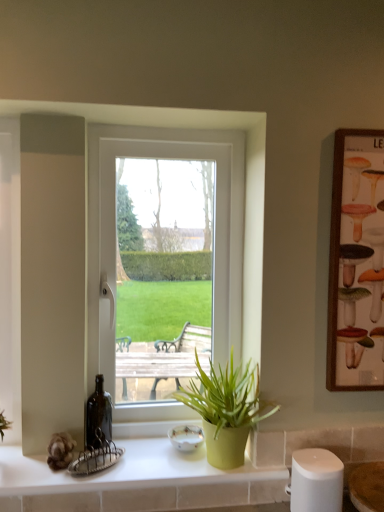
Question: Are green matte pot at lower center and white plastic window at center making contact?

Choices:
 (A) yes
 (B) no

Answer: (B)

Question: From a real-world perspective, is green matte pot at lower center located higher than white plastic window at center?

Choices:
 (A) yes
 (B) no

Answer: (B)

Question: Can you confirm if green matte pot at lower center is bigger than white plastic window at center?

Choices:
 (A) yes
 (B) no

Answer: (B)

Question: Can we say green matte pot at lower center lies outside white plastic window at center?

Choices:
 (A) yes
 (B) no

Answer: (A)

Question: Considering the relative sizes of green matte pot at lower center and white plastic window at center in the image provided, is green matte pot at lower center smaller than white plastic window at center?

Choices:
 (A) yes
 (B) no

Answer: (A)

Question: From the image's perspective, is green matte pot at lower center over white plastic window at center?

Choices:
 (A) yes
 (B) no

Answer: (B)

Question: Would you say wooden framed poster at right is part of green matte pot at lower center's contents?

Choices:
 (A) no
 (B) yes

Answer: (A)

Question: Is the depth of green matte pot at lower center greater than that of wooden framed poster at right?

Choices:
 (A) no
 (B) yes

Answer: (A)

Question: Does green matte pot at lower center come in front of wooden framed poster at right?

Choices:
 (A) no
 (B) yes

Answer: (B)

Question: Does green matte pot at lower center have a smaller size compared to wooden framed poster at right?

Choices:
 (A) no
 (B) yes

Answer: (A)

Question: Is green matte pot at lower center to the right of wooden framed poster at right from the viewer's perspective?

Choices:
 (A) yes
 (B) no

Answer: (B)

Question: Is green matte pot at lower center next to wooden framed poster at right and touching it?

Choices:
 (A) yes
 (B) no

Answer: (B)

Question: From the image's perspective, is white plastic window at center above green matte pot at lower center?

Choices:
 (A) yes
 (B) no

Answer: (A)